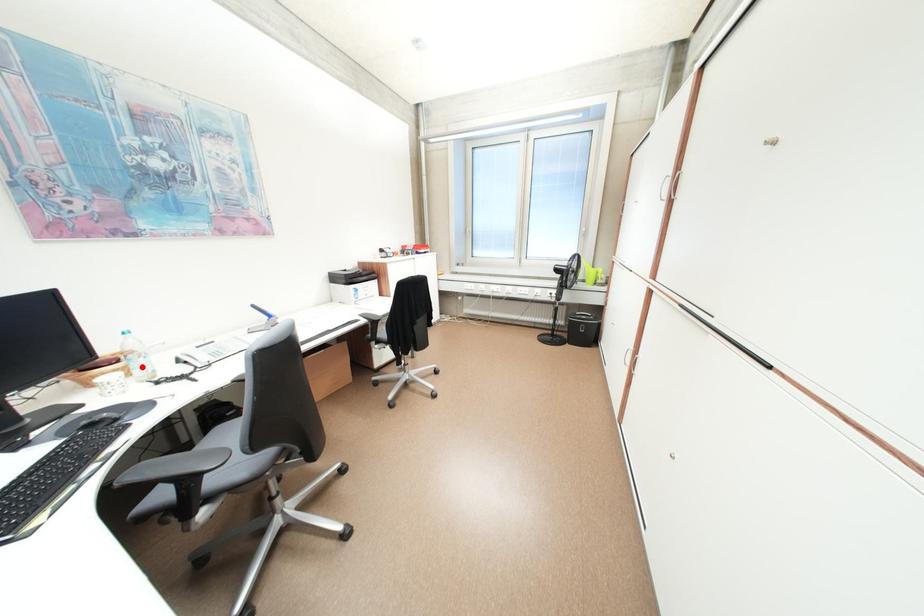
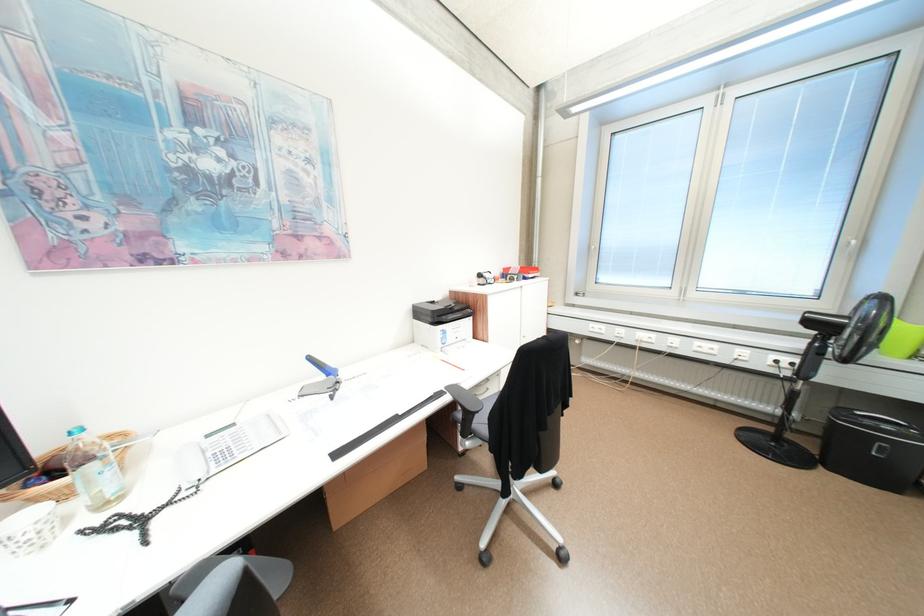
Question: I am providing you with two images of the same scene from different viewpoints. Given a red point in image1, look at the same physical point in image2. Is it:

Choices:
 (A) Closer to the viewpoint
 (B) Farther from the viewpoint

Answer: (A)